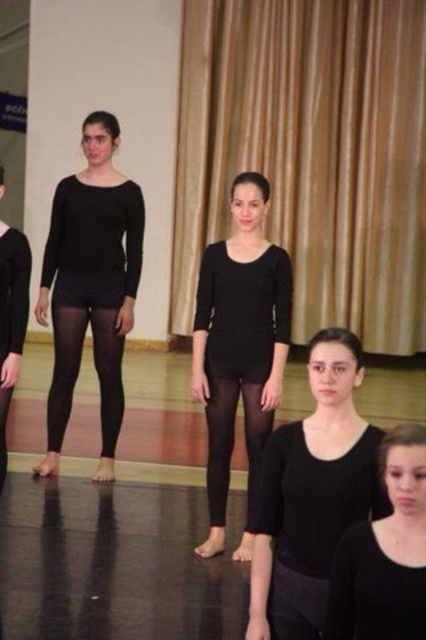
Question: Which object is the closest to the matte black leotard at center?

Choices:
 (A) black tights at center
 (B) black matte shirt at center

Answer: (B)

Question: From the image, what is the correct spatial relationship of black matte shirt at center in relation to black tights at center?

Choices:
 (A) below
 (B) above

Answer: (B)

Question: Observing the image, what is the correct spatial positioning of gold fabric curtain at upper center in reference to matte black leggings at center?

Choices:
 (A) right
 (B) left

Answer: (A)

Question: Considering the relative positions of matte black leotard at center and black matte shirt at center in the image provided, where is matte black leotard at center located with respect to black matte shirt at center?

Choices:
 (A) below
 (B) above

Answer: (A)

Question: Which point is closer to the camera?

Choices:
 (A) (224, 394)
 (B) (339, 454)

Answer: (B)

Question: Among these points, which one is farthest from the camera?

Choices:
 (A) (400, 148)
 (B) (75, 365)
 (C) (218, 444)
 (D) (382, 536)

Answer: (A)